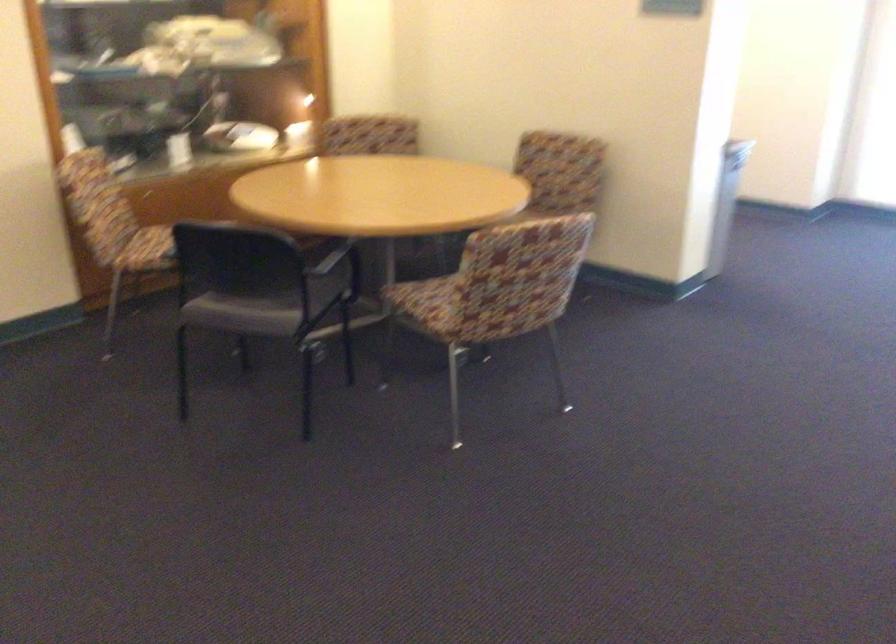
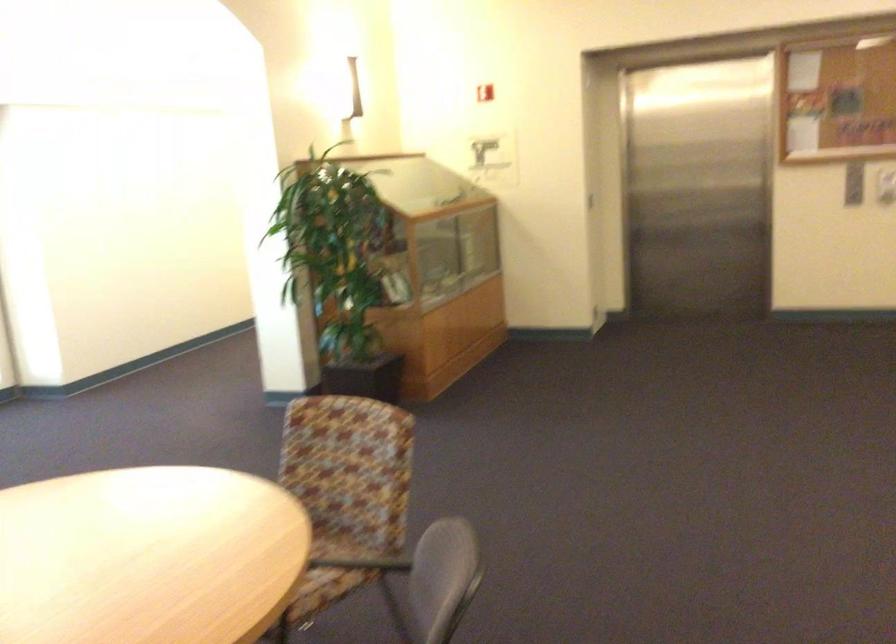
Find the pixel in the second image that matches [356,222] in the first image.

(288, 535)